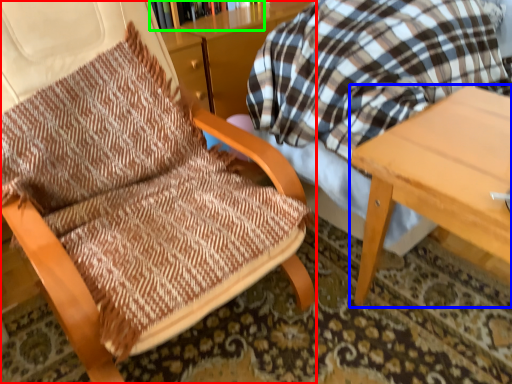
Question: Based on their relative distances, which object is nearer to chair (highlighted by a red box)? Choose from table (highlighted by a blue box) and bookcase (highlighted by a green box).

Choices:
 (A) table
 (B) bookcase

Answer: (A)